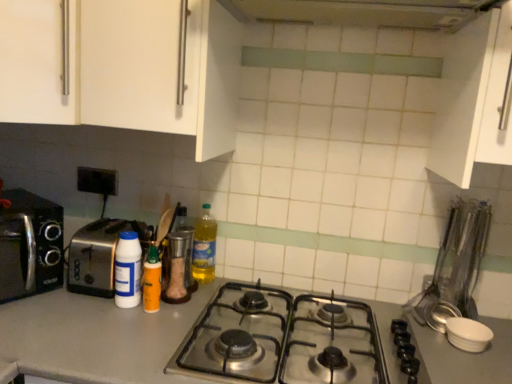
The height and width of the screenshot is (384, 512). Find the location of `free space in front of white matte bottle at center-left, marked as the fourth bottle in a right-to-left arrangement`. free space in front of white matte bottle at center-left, marked as the fourth bottle in a right-to-left arrangement is located at coordinates (103, 329).